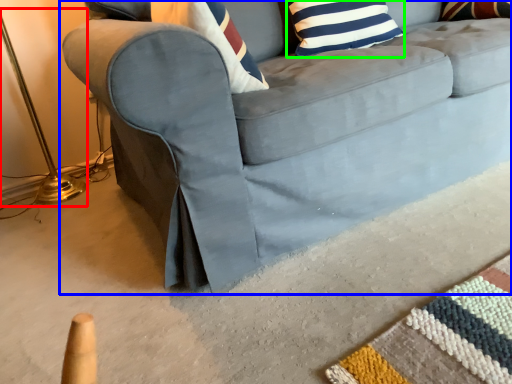
Question: Which object is the farthest from table lamp (highlighted by a red box)? Choose among these: studio couch (highlighted by a blue box) or pillow (highlighted by a green box).

Choices:
 (A) studio couch
 (B) pillow

Answer: (B)